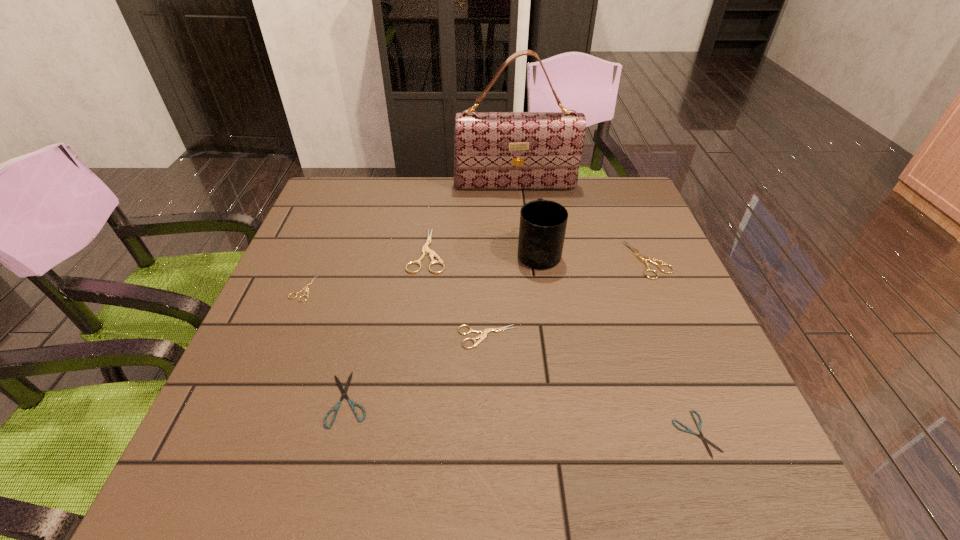
This screenshot has height=540, width=960. I want to click on the leftmost shears, so click(x=305, y=287).

Where is `the leftmost beige shears`? The height and width of the screenshot is (540, 960). the leftmost beige shears is located at coordinates (305, 287).

Find the location of a particular element. the bigger black shears is located at coordinates (344, 391).

Identify the location of the fifth shears from right to left. (344, 391).

Where is `the shortest shears`? The image size is (960, 540). the shortest shears is located at coordinates (688, 430).

Locate an element on the screen. the shortest object is located at coordinates (688, 430).

This screenshot has width=960, height=540. In order to click on free space located 0.390m on the front of the farthest object with the clasp in this screenshot , I will do `click(526, 285)`.

Where is `vacant space located 0.130m on the side of the black mug with the handle`? Image resolution: width=960 pixels, height=540 pixels. vacant space located 0.130m on the side of the black mug with the handle is located at coordinates (532, 207).

This screenshot has height=540, width=960. Find the location of `vacant space located on the side of the black mug with the handle`. vacant space located on the side of the black mug with the handle is located at coordinates (531, 201).

I want to click on vacant area situated 0.090m on the side of the black mug with the handle, so click(533, 215).